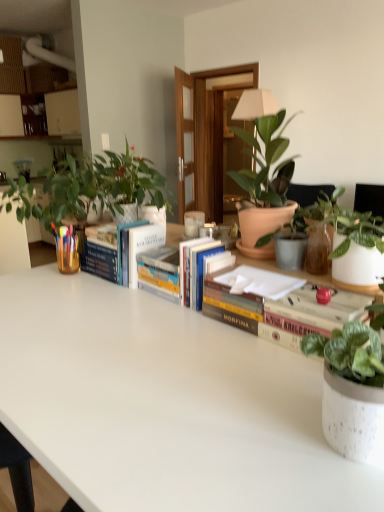
The image size is (384, 512). Find the location of `free point above hardcover book at center, positioned as the 3th book in left-to-right order (from a real-world perspective)`. free point above hardcover book at center, positioned as the 3th book in left-to-right order (from a real-world perspective) is located at coordinates (274, 289).